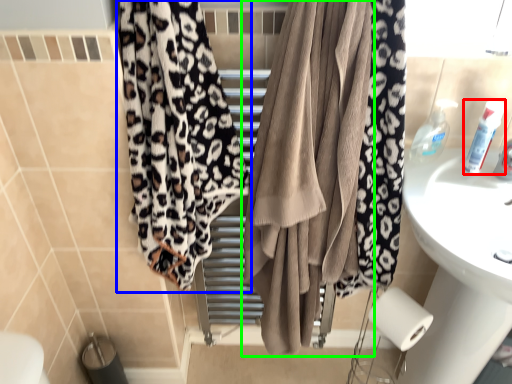
Question: Based on their relative distances, which object is farther from toiletry (highlighted by a red box)? Choose from curtain (highlighted by a blue box) and curtain (highlighted by a green box).

Choices:
 (A) curtain
 (B) curtain

Answer: (A)